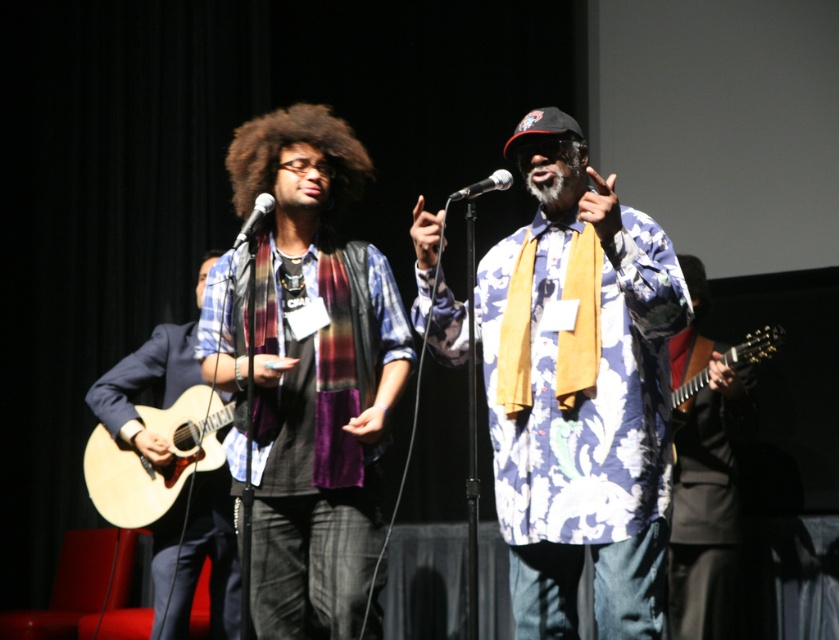
Which is more to the left, black glossy guitar at right or light brown acoustic guitar at left?

light brown acoustic guitar at left

Describe the element at coordinates (707, 502) in the screenshot. I see `black glossy guitar at right` at that location.

Identify the location of black glossy guitar at right. This screenshot has width=839, height=640. coord(707,502).

Can you confirm if velvet scarf at center is positioned below light brown wood acoustic guitar at right?

Actually, velvet scarf at center is above light brown wood acoustic guitar at right.

Does velvet scarf at center have a larger size compared to light brown wood acoustic guitar at right?

Correct, velvet scarf at center is larger in size than light brown wood acoustic guitar at right.

Who is more forward, [362,564] or [691,342]?

Point [362,564] is in front.

Where is `velvet scarf at center`? The height and width of the screenshot is (640, 839). velvet scarf at center is located at coordinates (314, 376).

Is the position of light brown acoustic guitar at left less distant than that of dark curly hair at center?

No, it is not.

Who is taller, light brown acoustic guitar at left or dark curly hair at center?

light brown acoustic guitar at left

Does point (118, 486) lie behind point (342, 147)?

Yes, it is behind point (342, 147).

The image size is (839, 640). I want to click on light brown acoustic guitar at left, so click(x=154, y=464).